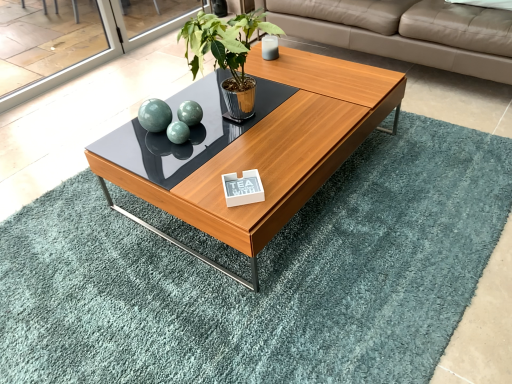
Question: From their relative heights in the image, would you say beige leather couch at upper right is taller or shorter than wooden coffee table at center?

Choices:
 (A) short
 (B) tall

Answer: (B)

Question: Considering the relative positions of beige leather couch at upper right and wooden coffee table at center in the image provided, is beige leather couch at upper right to the left or to the right of wooden coffee table at center?

Choices:
 (A) right
 (B) left

Answer: (A)

Question: Which is farther from the teal rug at center?

Choices:
 (A) wooden coffee table at center
 (B) beige leather couch at upper right
 (C) green leafy plant at center
 (D) white glossy plaque at center

Answer: (B)

Question: Which object is the closest to the wooden coffee table at center?

Choices:
 (A) beige leather couch at upper right
 (B) green leafy plant at center
 (C) teal rug at center
 (D) white glossy plaque at center

Answer: (B)